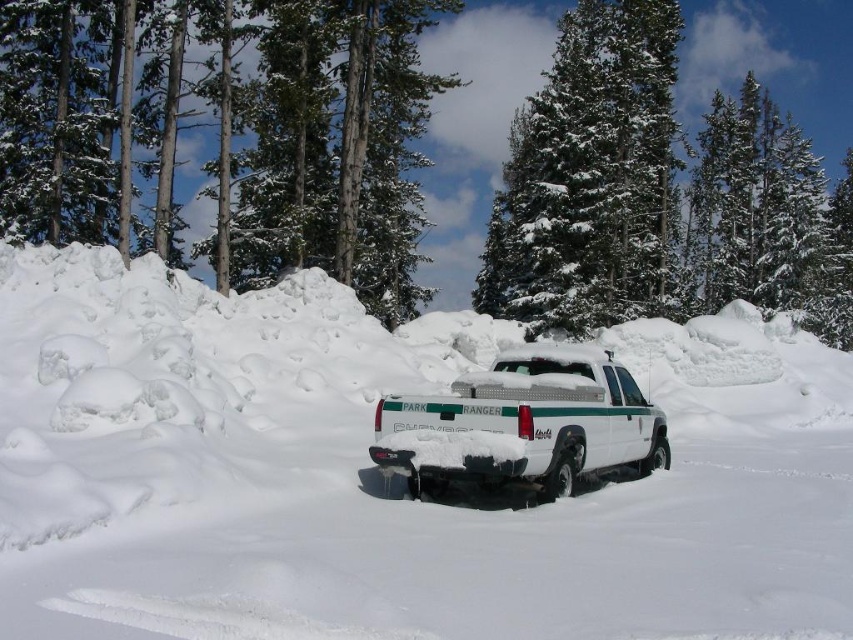
You are a park ranger who needs to reach the green textured pine trees at upper center from the white matte truck at center. Given that your average walking speed is 3 miles per hour, how long will it take you to walk to the trees?

The distance between the green textured pine trees at upper center and the white matte truck at center is 75.47 feet. Converting this distance to miles, 75.47 feet is approximately 0.0143 miles. At a walking speed of 3 miles per hour, the time required would be distance divided by speed, so 0.0143 miles divided by 3 mph equals approximately 0.00477 hours. Converting hours to minutes by multiplying by 60, this results in roughly 0.286 minutes, which is about 17 seconds. Therefore, it will take approximately